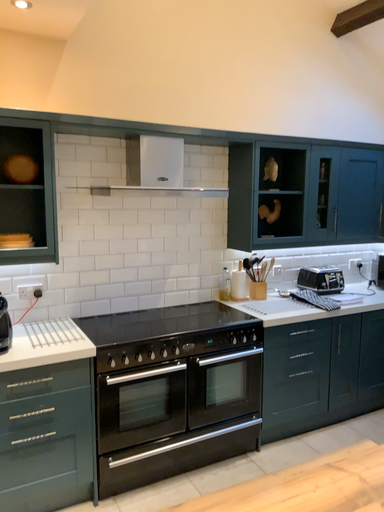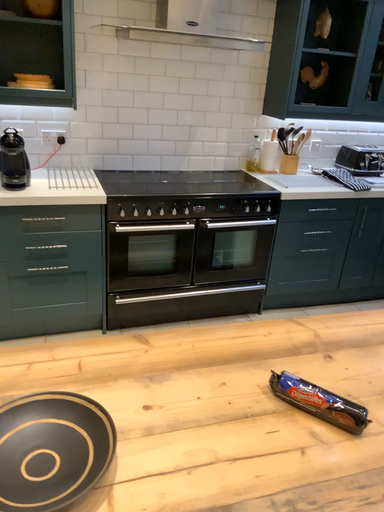
Question: Which way did the camera rotate in the video?

Choices:
 (A) rotated right
 (B) rotated left

Answer: (B)